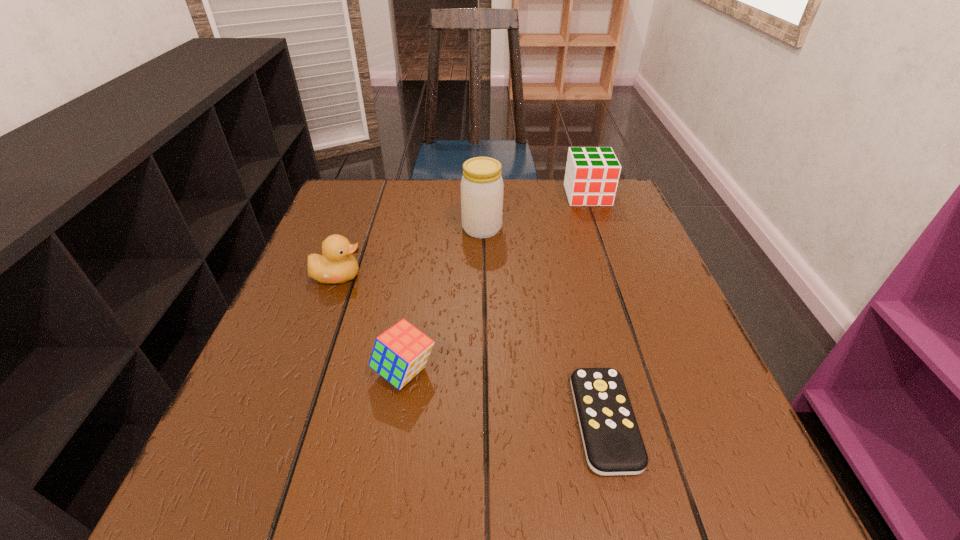
The width and height of the screenshot is (960, 540). What are the coordinates of `free space located on the red face of the farther cube` in the screenshot? It's located at (611, 261).

Where is `vacant region located facing forward on the duckling`? This screenshot has width=960, height=540. vacant region located facing forward on the duckling is located at coordinates (x=540, y=276).

This screenshot has width=960, height=540. I want to click on vacant space situated on the front of the shorter cube, so click(x=395, y=435).

Locate an element on the screen. Image resolution: width=960 pixels, height=540 pixels. vacant space located on the right of the remote control is located at coordinates point(704,421).

Locate an element on the screen. jar that is at the far edge is located at coordinates (482, 187).

This screenshot has height=540, width=960. Find the location of `cube located in the far edge section of the desktop`. cube located in the far edge section of the desktop is located at coordinates (591, 179).

At what (x,y) coordinates should I click in order to perform the action: click on object that is positioned at the near edge. Please return your answer as a coordinate pair (x, y). Looking at the image, I should click on (613, 445).

Image resolution: width=960 pixels, height=540 pixels. I want to click on object that is at the left edge, so click(337, 264).

At what (x,y) coordinates should I click in order to perform the action: click on cube at the right edge. Please return your answer as a coordinate pair (x, y). The width and height of the screenshot is (960, 540). Looking at the image, I should click on (591, 179).

Locate an element on the screen. This screenshot has width=960, height=540. remote control that is positioned at the right edge is located at coordinates (613, 445).